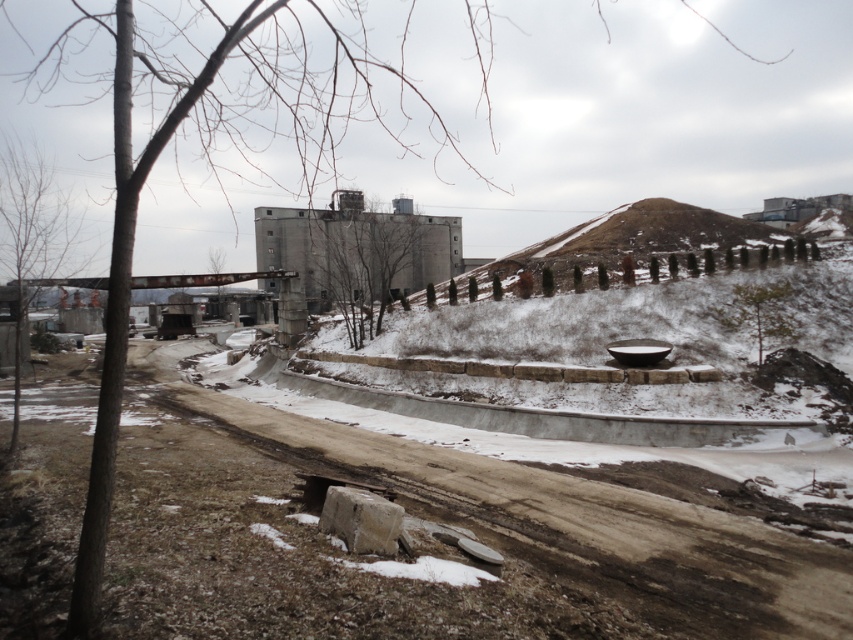
You are a landscape architect planning to plant a new tree between the bare branches at center and the bare wood tree at left. Given their current distance, is there enough space to place a new tree that requires 10 meters of clearance from existing trees?

The distance between the bare branches at center and the bare wood tree at left is 35.50 meters. Since the required clearance is 10 meters, subtracting twice the required clearance from the total distance gives 35.50m minus 20m equals 15.50m. This remaining space allows for planting a new tree in between them.

You are standing at the point with coordinates point (590, 500) and want to walk towards the point with coordinates point (412, 237). Given that the path between them is clear of obstacles, which direction should you head to reach your destination?

Since point (590, 500) is closer to the viewer than point (412, 237), you should head towards the direction away from you to reach point (412, 237).

You are standing on the dirt path and want to walk towards the bare wood tree at left. However, there is a fence blocking your path. To avoid the fence, you decide to walk around it by going towards the bare branches at center first. Which direction should you head first to reach the tree?

Since the bare branches at center is closer to you than the bare wood tree at left, you should head towards the bare branches at center first to navigate around the fence and reach the tree.